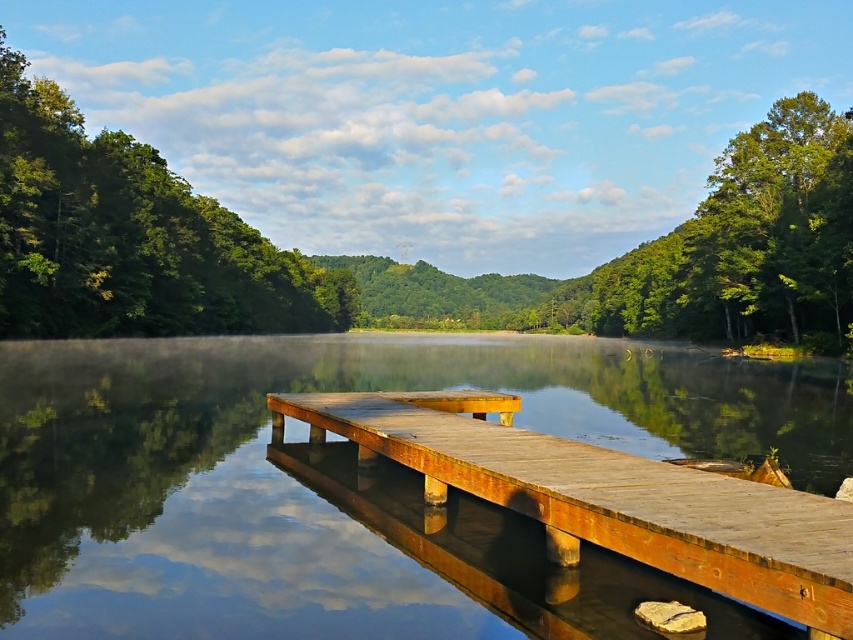
Question: Considering the relative positions of green leafy tree at center and green leafy tree at left in the image provided, where is green leafy tree at center located with respect to green leafy tree at left?

Choices:
 (A) right
 (B) left

Answer: (A)

Question: Which object is positioned closest to the rustic wood dock at center?

Choices:
 (A) green leafy tree at left
 (B) green leafy tree at center

Answer: (A)

Question: Which of these objects is positioned farthest from the green leafy tree at left?

Choices:
 (A) rustic wood dock at center
 (B) green leafy tree at center

Answer: (A)

Question: Can you confirm if green leafy tree at center is positioned to the right of rustic wood dock at center?

Choices:
 (A) yes
 (B) no

Answer: (B)

Question: Is the position of green leafy tree at center less distant than that of green leafy tree at left?

Choices:
 (A) no
 (B) yes

Answer: (B)

Question: Estimate the real-world distances between objects in this image. Which object is closer to the green leafy tree at center?

Choices:
 (A) green leafy tree at left
 (B) rustic wood dock at center

Answer: (A)